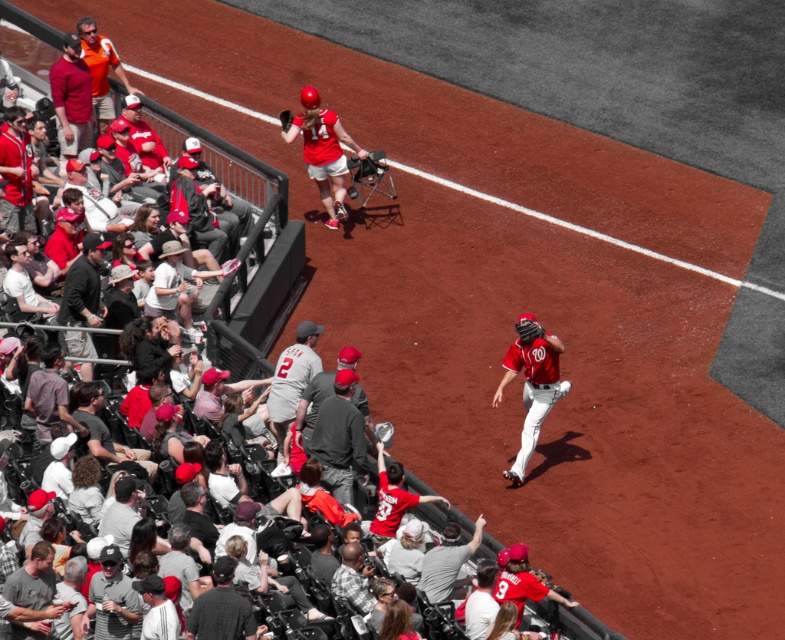
Is red jersey baseball player at center taller than matte red jersey at center?

Yes.

Is red jersey baseball player at center above matte red jersey at center?

Yes.

Which is in front, point (117, 26) or point (535, 429)?

Positioned in front is point (535, 429).

Where is `red jersey baseball player at center`? red jersey baseball player at center is located at coordinates (502, 300).

Looking at this image, who is more distant from viewer, (x=552, y=348) or (x=318, y=147)?

Positioned behind is point (x=318, y=147).

Is the position of matte red jersey at center more distant than that of matte red helmet at upper center?

No, it is in front of matte red helmet at upper center.

This screenshot has height=640, width=785. Find the location of `matte red jersey at center`. matte red jersey at center is located at coordinates (531, 384).

Between red jersey baseball player at center and dark brown leather glove at upper center, which one has less height?

With less height is dark brown leather glove at upper center.

Who is more forward, (294,108) or (283,116)?

Point (283,116) is more forward.

Who is more distant from viewer, (x=575, y=173) or (x=287, y=116)?

Positioned behind is point (x=575, y=173).

Identify the location of red jersey baseball player at center. This screenshot has width=785, height=640. (502, 300).